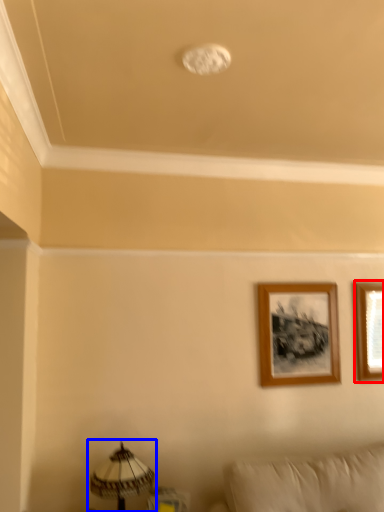
Question: Which point is closer to the camera, picture frame (highlighted by a red box) or table lamp (highlighted by a blue box)?

Choices:
 (A) picture frame
 (B) table lamp

Answer: (B)